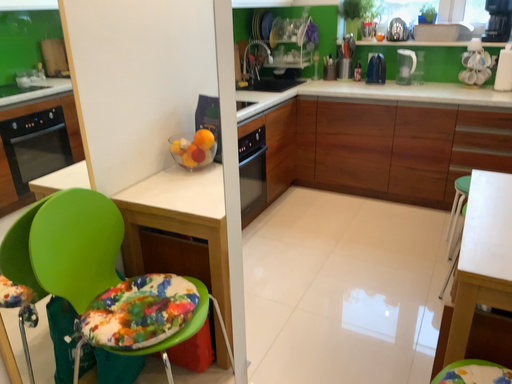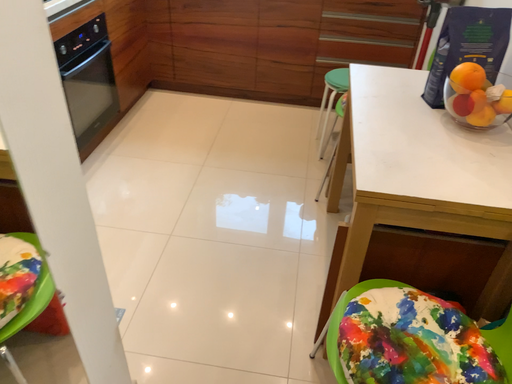
Question: How did the camera likely rotate when shooting the video?

Choices:
 (A) rotated upward
 (B) rotated downward

Answer: (B)